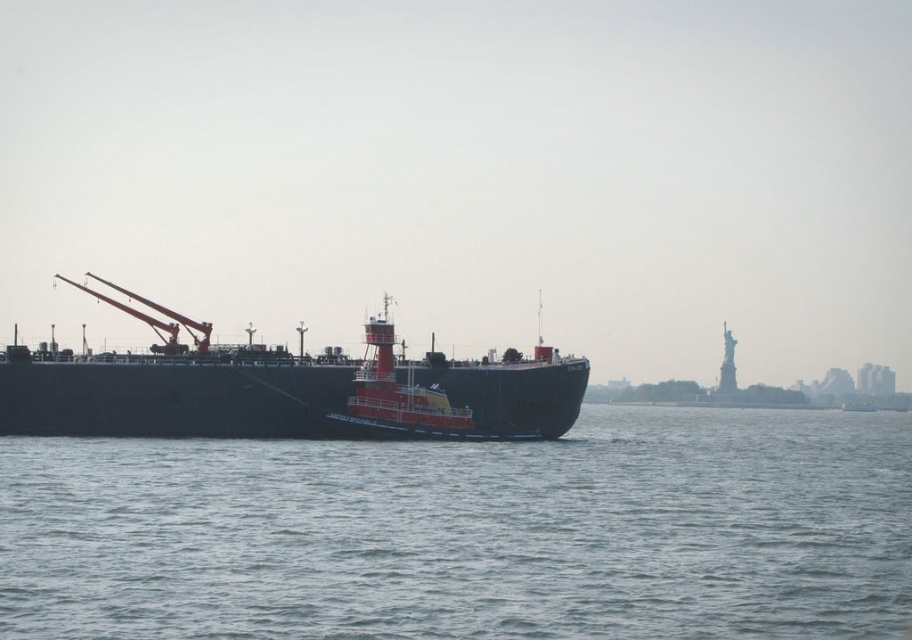
In the scene shown: You are navigating a cargo ship and need to avoid shallow waters. The gray water at center indicates deeper waters. Where should you steer the ship to stay in deeper waters?

The gray water at center is located at point [469,532], so steering the ship towards that coordinate will keep it in deeper waters.

You are standing on the deck of the cargo ship and looking around. There is a point marked at coordinates (469,532). What is located at that point?

The point at coordinates (469,532) indicates gray water at center.

You are a sailor on the matte black ship at center. You want to check if the gray water at center can be used to determine the ship is floating. Can you confirm based on their heights?

The gray water at center has a lesser height compared to the matte black ship at center, which means the ship is indeed floating on the water since the water level is lower than the ship.